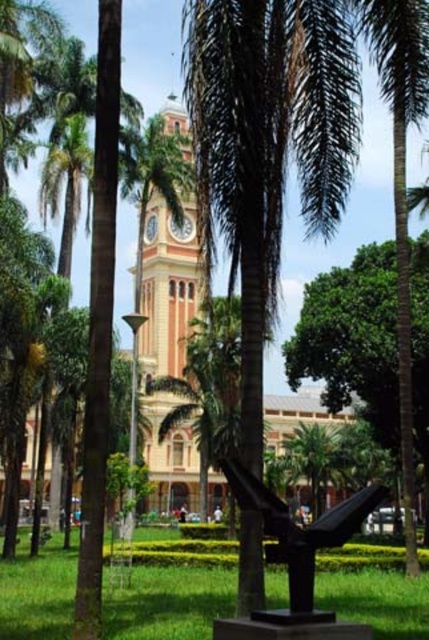
You are a gardener who wants to place a new flower pot between the green grass at center and the black polished sculpture at center. Based on their current positions, which object should the flower pot be closer to?

The green grass at center is positioned on the left side of black polished sculpture at center, so the flower pot should be placed closer to the black polished sculpture at center to maintain symmetry between the two objects.